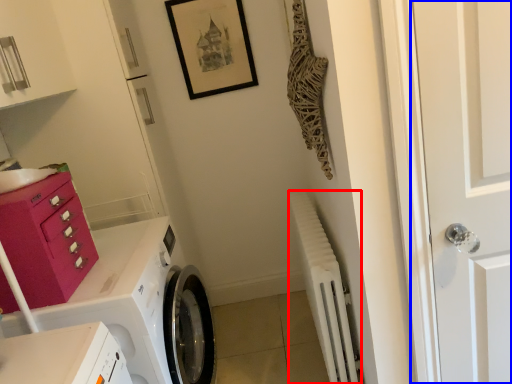
Question: Which object appears closest to the camera in this image, radiator (highlighted by a red box) or door (highlighted by a blue box)?

Choices:
 (A) radiator
 (B) door

Answer: (B)